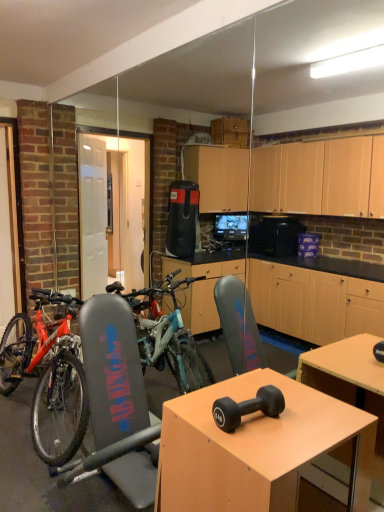
Question: Is matte wood desk at center oriented away from black rubber dumbbell at center?

Choices:
 (A) no
 (B) yes

Answer: (A)

Question: Is black rubber dumbbell at center a part of matte wood desk at center?

Choices:
 (A) yes
 (B) no

Answer: (B)

Question: Is matte wood desk at center completely or partially outside of black rubber dumbbell at center?

Choices:
 (A) yes
 (B) no

Answer: (A)

Question: Can you confirm if matte wood desk at center is thinner than black rubber dumbbell at center?

Choices:
 (A) yes
 (B) no

Answer: (B)

Question: Considering the relative sizes of matte wood desk at center and black rubber dumbbell at center in the image provided, is matte wood desk at center smaller than black rubber dumbbell at center?

Choices:
 (A) yes
 (B) no

Answer: (B)

Question: Considering the relative positions of matte wood desk at center and black rubber dumbbell at center in the image provided, is matte wood desk at center behind black rubber dumbbell at center?

Choices:
 (A) yes
 (B) no

Answer: (B)

Question: Could you tell me if black rubber dumbbell at center is turned towards shiny metallic bicycle at left?

Choices:
 (A) no
 (B) yes

Answer: (A)

Question: Does black rubber dumbbell at center contain shiny metallic bicycle at left?

Choices:
 (A) no
 (B) yes

Answer: (A)

Question: Is black rubber dumbbell at center next to shiny metallic bicycle at left?

Choices:
 (A) yes
 (B) no

Answer: (B)

Question: Is black rubber dumbbell at center taller than shiny metallic bicycle at left?

Choices:
 (A) no
 (B) yes

Answer: (A)

Question: From the image's perspective, is black rubber dumbbell at center on top of shiny metallic bicycle at left?

Choices:
 (A) no
 (B) yes

Answer: (B)

Question: Is black rubber dumbbell at center positioned behind shiny metallic bicycle at left?

Choices:
 (A) no
 (B) yes

Answer: (A)

Question: Is shiny metallic bicycle at left shorter than matte wood desk at center?

Choices:
 (A) no
 (B) yes

Answer: (A)